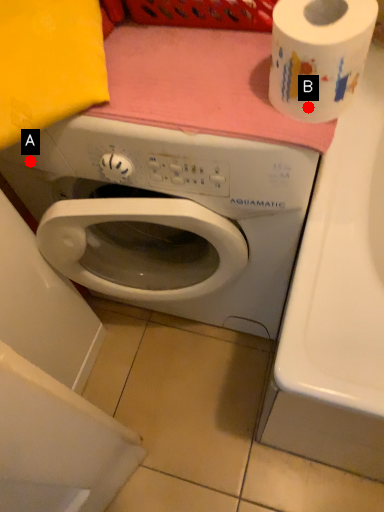
Question: Two points are circled on the image, labeled by A and B beside each circle. Which of the following is the closest to the observer?

Choices:
 (A) A is closer
 (B) B is closer

Answer: (B)